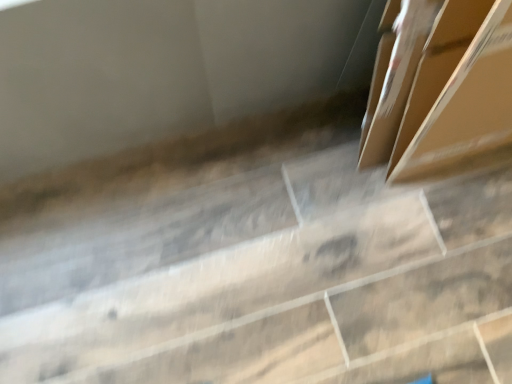
Measure the distance between point (137, 242) and camera.

They are 95.00 centimeters apart.

This screenshot has height=384, width=512. Describe the element at coordinates (277, 285) in the screenshot. I see `transparent plastic concrete at center` at that location.

Image resolution: width=512 pixels, height=384 pixels. Identify the location of transparent plastic concrete at center. click(277, 285).

You are a GUI agent. You are given a task and a screenshot of the screen. Output one action in this format:
    pyautogui.click(x=<x>, y=<y>)
    Task: Click on the brown cardboard box at center
    
    Given the screenshot: What is the action you would take?
    pyautogui.click(x=458, y=90)

This screenshot has height=384, width=512. What do you see at coordinates (458, 90) in the screenshot?
I see `brown cardboard box at center` at bounding box center [458, 90].

The width and height of the screenshot is (512, 384). In order to click on transparent plastic concrete at center in this screenshot , I will do click(277, 285).

From the picture: Does transparent plastic concrete at center appear on the left side of brown cardboard box at center?

Yes, transparent plastic concrete at center is to the left of brown cardboard box at center.

Is the position of transparent plastic concrete at center less distant than that of brown cardboard box at center?

No, transparent plastic concrete at center is further to the viewer.

Considering the positions of point (63, 284) and point (455, 20), is point (63, 284) closer or farther from the camera than point (455, 20)?

Point (63, 284).

From the image's perspective, between transparent plastic concrete at center and brown cardboard box at center, which one is located above?

brown cardboard box at center, from the image's perspective.

From a real-world perspective, relative to brown cardboard box at center, is transparent plastic concrete at center vertically above or below?

transparent plastic concrete at center is situated lower than brown cardboard box at center in the real world.

Is transparent plastic concrete at center wider than brown cardboard box at center?

Yes.

Considering the relative sizes of transparent plastic concrete at center and brown cardboard box at center in the image provided, is transparent plastic concrete at center shorter than brown cardboard box at center?

Yes, transparent plastic concrete at center is shorter than brown cardboard box at center.

Does transparent plastic concrete at center have a smaller size compared to brown cardboard box at center?

Actually, transparent plastic concrete at center might be larger than brown cardboard box at center.

Does transparent plastic concrete at center contain brown cardboard box at center?

No, transparent plastic concrete at center does not contain brown cardboard box at center.

Is the surface of transparent plastic concrete at center in direct contact with brown cardboard box at center?

transparent plastic concrete at center and brown cardboard box at center are not in contact.

Is transparent plastic concrete at center facing away from brown cardboard box at center?

No, transparent plastic concrete at center's orientation is not away from brown cardboard box at center.

How many degrees apart are the facing directions of transparent plastic concrete at center and brown cardboard box at center?

178 degrees separate the facing orientations of transparent plastic concrete at center and brown cardboard box at center.

How much distance is there between transparent plastic concrete at center and brown cardboard box at center?

A distance of 12.99 inches exists between transparent plastic concrete at center and brown cardboard box at center.

Locate an element on the screen. concrete that appears behind the brown cardboard box at center is located at coordinates (277, 285).

In the scene shown: Is brown cardboard box at center at the right side of transparent plastic concrete at center?

Correct, you'll find brown cardboard box at center to the right of transparent plastic concrete at center.

Considering the positions of objects brown cardboard box at center and transparent plastic concrete at center in the image provided, who is behind, brown cardboard box at center or transparent plastic concrete at center?

Positioned behind is transparent plastic concrete at center.

Based on the photo, which is farther, [461,109] or [41,346]?

Point [41,346]

From the image's perspective, is brown cardboard box at center located above or below transparent plastic concrete at center?

From the image's perspective, brown cardboard box at center appears above transparent plastic concrete at center.

From a real-world perspective, is brown cardboard box at center physically located above or below transparent plastic concrete at center?

In terms of real-world spatial position, brown cardboard box at center is above transparent plastic concrete at center.

Is brown cardboard box at center wider than transparent plastic concrete at center?

In fact, brown cardboard box at center might be narrower than transparent plastic concrete at center.

Considering the sizes of brown cardboard box at center and transparent plastic concrete at center in the image, is brown cardboard box at center taller or shorter than transparent plastic concrete at center?

In the image, brown cardboard box at center appears to be taller than transparent plastic concrete at center.

Looking at this image, between brown cardboard box at center and transparent plastic concrete at center, which one has smaller size?

brown cardboard box at center is smaller.

Is brown cardboard box at center surrounding transparent plastic concrete at center?

No.

Is brown cardboard box at center with transparent plastic concrete at center?

No.

Is brown cardboard box at center oriented away from transparent plastic concrete at center?

brown cardboard box at center is not turned away from transparent plastic concrete at center.

How many degrees apart are the facing directions of brown cardboard box at center and transparent plastic concrete at center?

The angle between the facing direction of brown cardboard box at center and the facing direction of transparent plastic concrete at center is 178 degrees.

At what (x,y) coordinates should I click in order to perform the action: click on box above the transparent plastic concrete at center (from a real-world perspective). Please return your answer as a coordinate pair (x, y). The image size is (512, 384). Looking at the image, I should click on (458, 90).

The height and width of the screenshot is (384, 512). In order to click on box that appears above the transparent plastic concrete at center (from the image's perspective) in this screenshot , I will do `click(458, 90)`.

In the image, there is a brown cardboard box at center. Where is `concrete below it (from a real-world perspective)`? concrete below it (from a real-world perspective) is located at coordinates (277, 285).